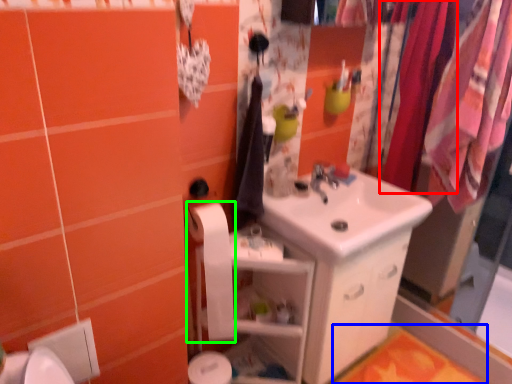
Question: Estimate the real-world distances between objects in this image. Which object is farther from clothesline (highlighted by a red box), bath mat (highlighted by a blue box) or toilet paper (highlighted by a green box)?

Choices:
 (A) bath mat
 (B) toilet paper

Answer: (A)